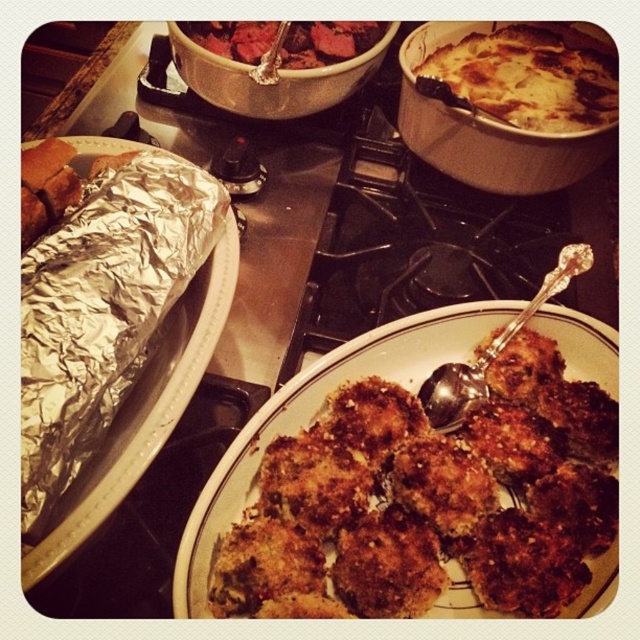
You are a chef preparing a meal and need to place the dark red meat at center on the counter. The counter has a coordinate system where the bottom left corner is the origin. Where should you place it?

The dark red meat at center should be placed at coordinates approximately 0.067 on the x axis and 0.512 on the y axis.